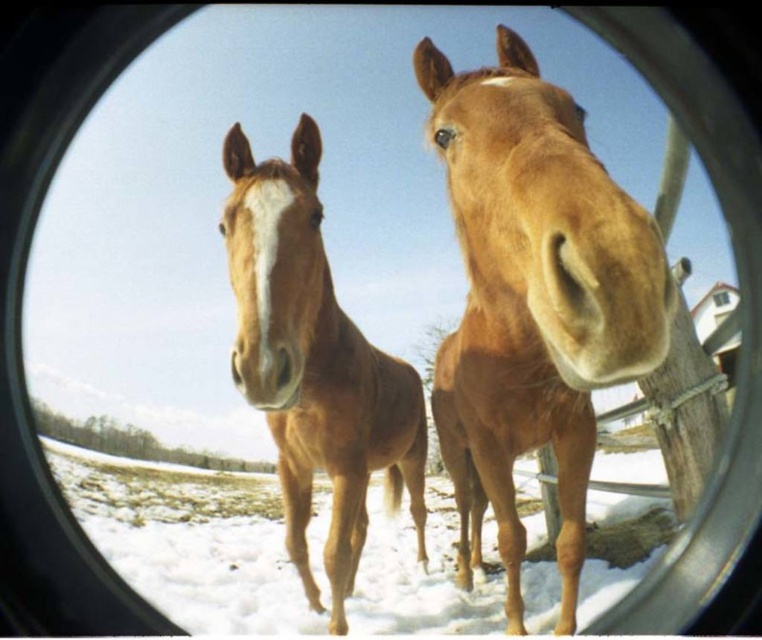
Question: Does brown matte horse at center lie in front of brown glossy horse at center?

Choices:
 (A) no
 (B) yes

Answer: (B)

Question: Can you confirm if brown matte horse at center is positioned to the left of brown glossy horse at center?

Choices:
 (A) yes
 (B) no

Answer: (B)

Question: Is brown matte horse at center to the right of brown glossy horse at center from the viewer's perspective?

Choices:
 (A) yes
 (B) no

Answer: (A)